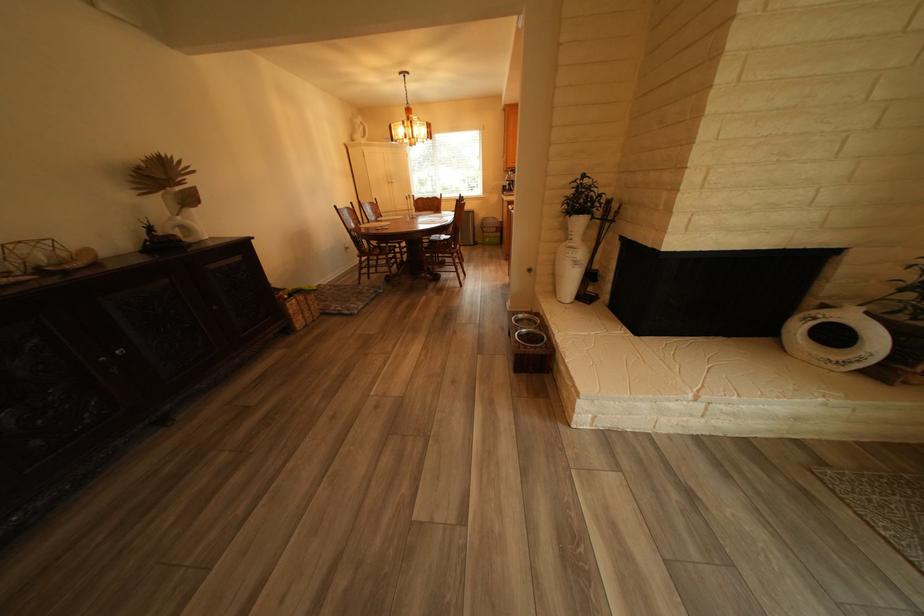
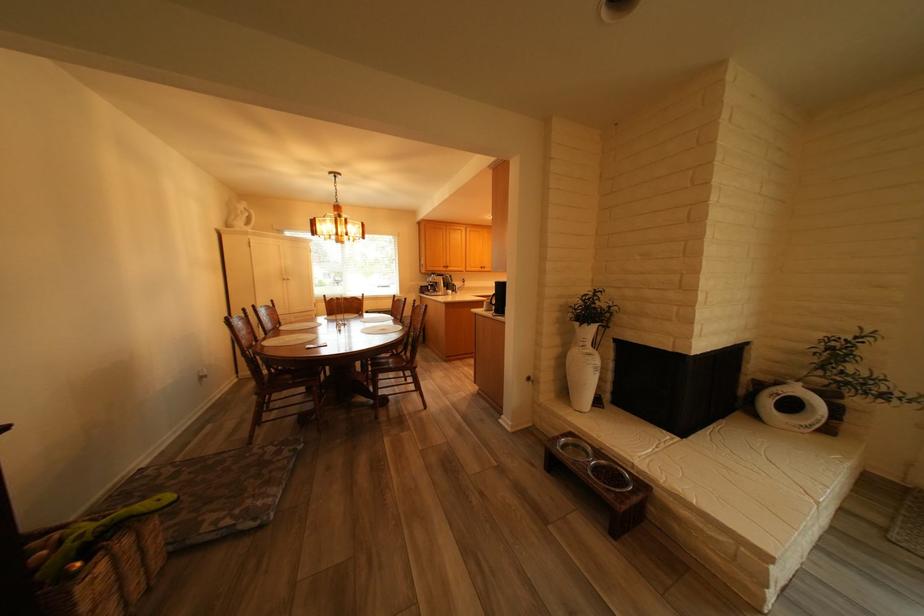
In the second image, find the point that corresponds to point (379, 246) in the first image.

(276, 374)